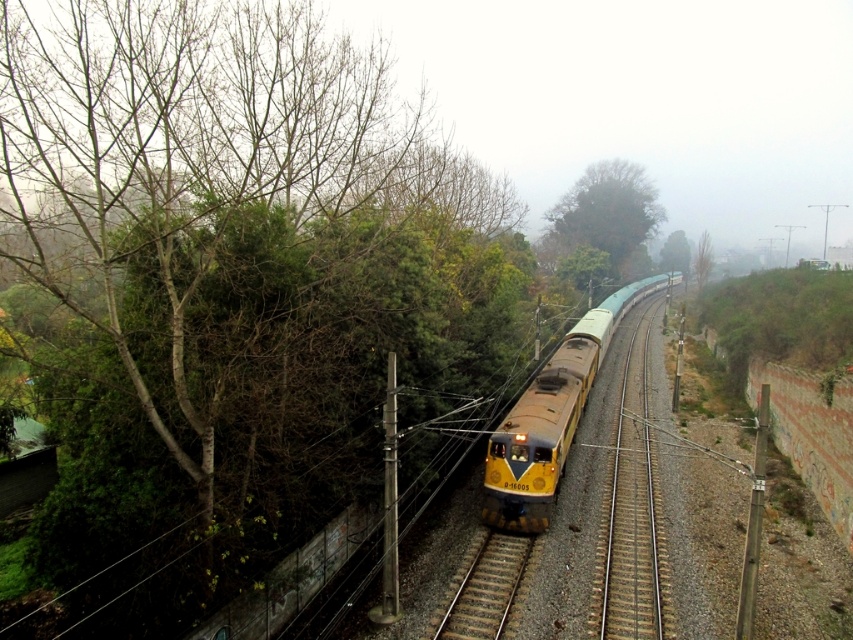
You are a train engineer observing the scene. You notice the green leafy tree at upper center and the brown gravel track at center. Which object is taller?

The green leafy tree at upper center is taller than the brown gravel track at center.